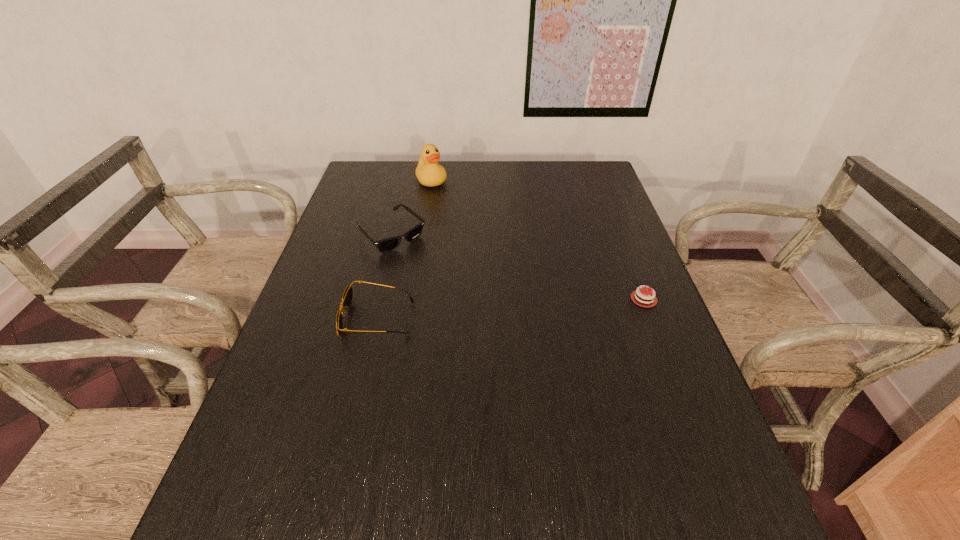
Find the location of `the nearer sunglasses`. the nearer sunglasses is located at coordinates click(x=347, y=297).

This screenshot has height=540, width=960. I want to click on the shortest object, so click(x=636, y=297).

I want to click on chocolate cake, so click(x=636, y=297).

This screenshot has height=540, width=960. Find the location of `the tallest object`. the tallest object is located at coordinates (429, 173).

Identify the location of duck. The height and width of the screenshot is (540, 960). (429, 173).

What are the coordinates of `the farther sunglasses` in the screenshot? It's located at (389, 244).

Where is `vacant region located on the lenses of the nearer sunglasses`? This screenshot has width=960, height=540. vacant region located on the lenses of the nearer sunglasses is located at coordinates (323, 319).

In order to click on blank space located on the lenses of the nearer sunglasses in this screenshot , I will do `click(301, 319)`.

You are a GUI agent. You are given a task and a screenshot of the screen. Output one action in this format:
    pyautogui.click(x=<x>, y=<y>)
    Task: Click on the vacant area situated on the back of the shortest object
    The image size is (960, 540).
    Given the screenshot: What is the action you would take?
    pyautogui.click(x=625, y=249)

This screenshot has width=960, height=540. What are the coordinates of `vacant region located at the beak of the farthest object` in the screenshot? It's located at (457, 215).